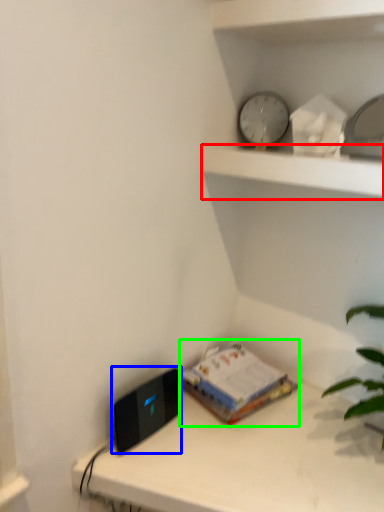
Question: Based on their relative distances, which object is farther from shelf (highlighted by a red box)? Choose from ipod (highlighted by a blue box) and paperback book (highlighted by a green box).

Choices:
 (A) ipod
 (B) paperback book

Answer: (A)